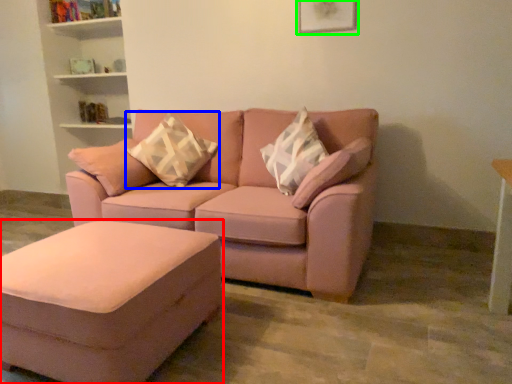
Question: Which object is the farthest from table (highlighted by a red box)? Choose among these: pillow (highlighted by a blue box) or picture frame (highlighted by a green box).

Choices:
 (A) pillow
 (B) picture frame

Answer: (B)